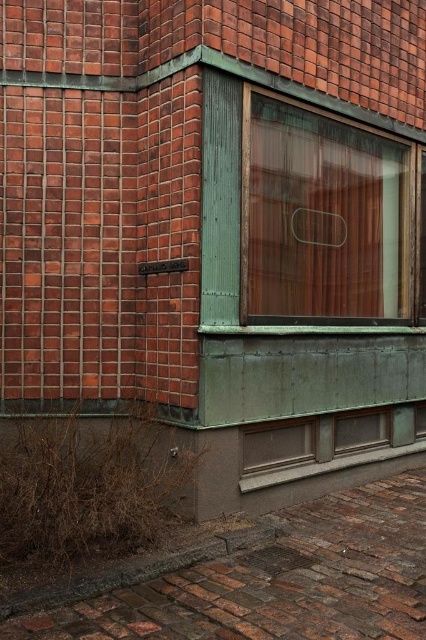
Is translucent wood window at upper center above matte bronze window at lower center?

Yes.

Which is more to the right, translucent wood window at upper center or matte bronze window at lower center?

matte bronze window at lower center

Is point (316, 156) farther from viewer compared to point (345, 440)?

No.

Locate an element on the screen. Image resolution: width=426 pixels, height=640 pixels. translucent wood window at upper center is located at coordinates pyautogui.click(x=322, y=218).